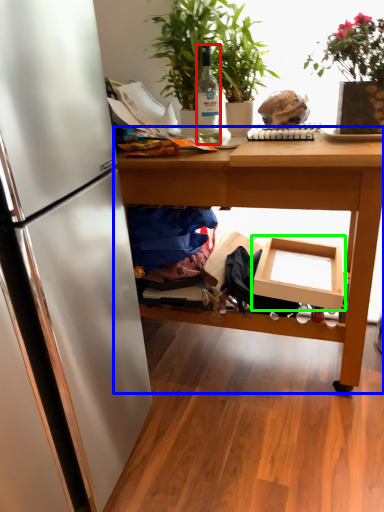
Question: Which object is the closest to the bottle (highlighted by a red box)? Choose among these: table (highlighted by a blue box) or cardboard box (highlighted by a green box).

Choices:
 (A) table
 (B) cardboard box

Answer: (A)